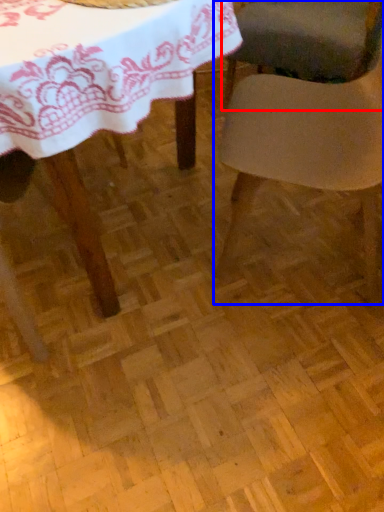
Question: Which point is further to the camera, chair (highlighted by a red box) or chair (highlighted by a blue box)?

Choices:
 (A) chair
 (B) chair

Answer: (A)